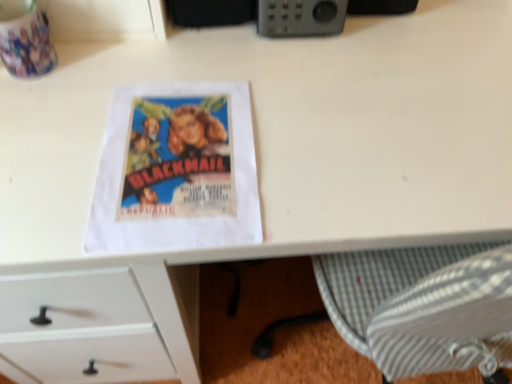
Where is `free location above matte paper poster at center (from a real-world perspective)`? The image size is (512, 384). free location above matte paper poster at center (from a real-world perspective) is located at coordinates (184, 150).